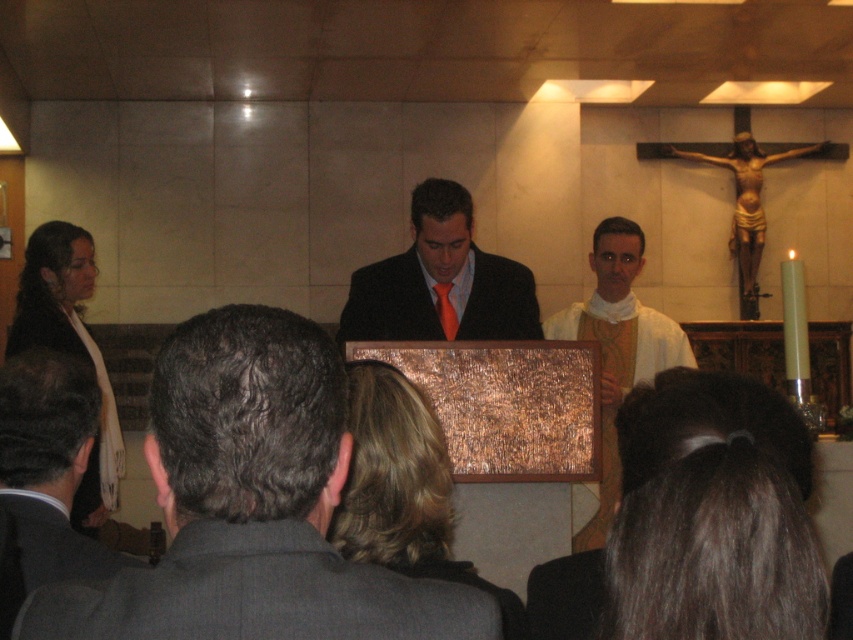
Question: Among these objects, which one is nearest to the camera?

Choices:
 (A) matte black suit at center
 (B) white cloth at center

Answer: (B)

Question: Does matte black suit at center have a larger size compared to white cloth at center?

Choices:
 (A) yes
 (B) no

Answer: (B)

Question: Which object is closer to the camera taking this photo?

Choices:
 (A) dark brown suit at lower left
 (B) gray suit at center
 (C) matte black suit at center

Answer: (B)

Question: Which point appears closest to the camera in this image?

Choices:
 (A) (637, 260)
 (B) (432, 612)

Answer: (B)

Question: Is gray suit at center bigger than matte black suit at center?

Choices:
 (A) no
 (B) yes

Answer: (A)

Question: Can you confirm if dark brown suit at lower left is positioned above matte black suit at center?

Choices:
 (A) yes
 (B) no

Answer: (B)